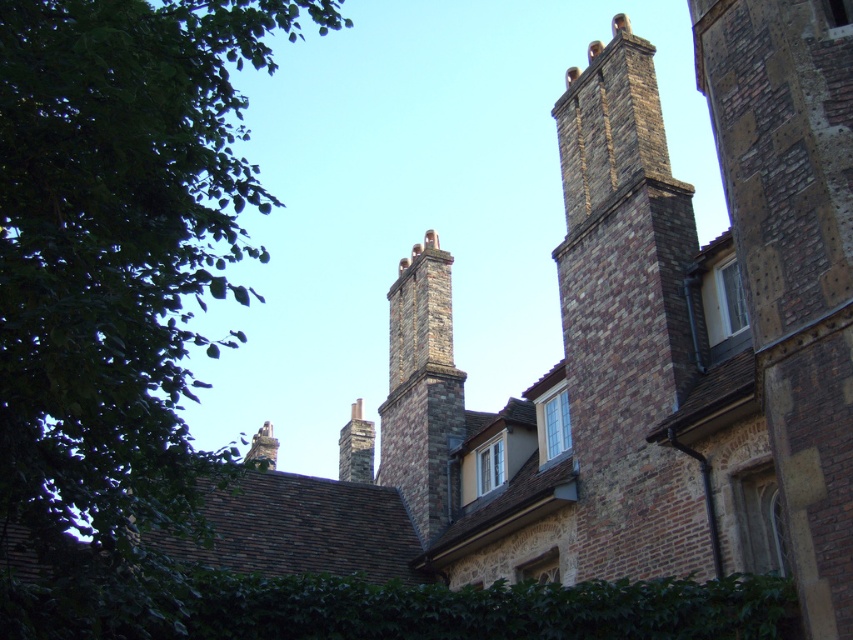
Question: Can you confirm if brown stone chimney at center is smaller than smooth stone chimney at upper center?

Choices:
 (A) yes
 (B) no

Answer: (A)

Question: Estimate the real-world distances between objects in this image. Which object is closer to the green leafy tree at upper left?

Choices:
 (A) brown stone chimney at center
 (B) smooth stone chimney at upper center

Answer: (A)

Question: Estimate the real-world distances between objects in this image. Which object is closer to the stone chimney at center?

Choices:
 (A) smooth stone chimney at upper center
 (B) green leafy tree at upper left

Answer: (A)

Question: Does brown stone chimney at center have a greater width compared to stone chimney at center?

Choices:
 (A) yes
 (B) no

Answer: (B)

Question: Is brown brick chimney at upper right wider than smooth stone chimney at upper center?

Choices:
 (A) yes
 (B) no

Answer: (B)

Question: Which of the following is the farthest from the observer?

Choices:
 (A) brown stone chimney at center
 (B) brown brick chimney at upper right
 (C) smooth stone chimney at upper center
 (D) green leafy tree at upper left

Answer: (C)